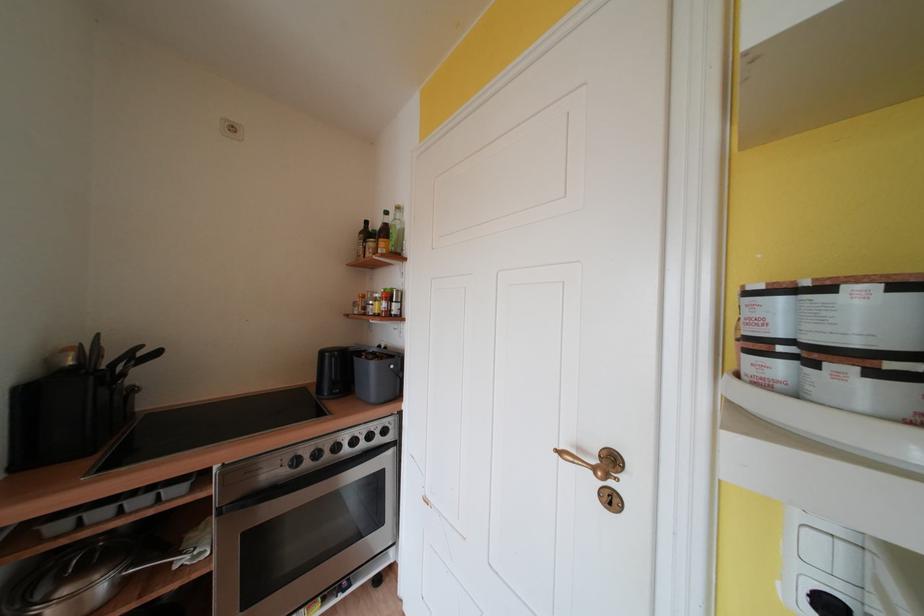
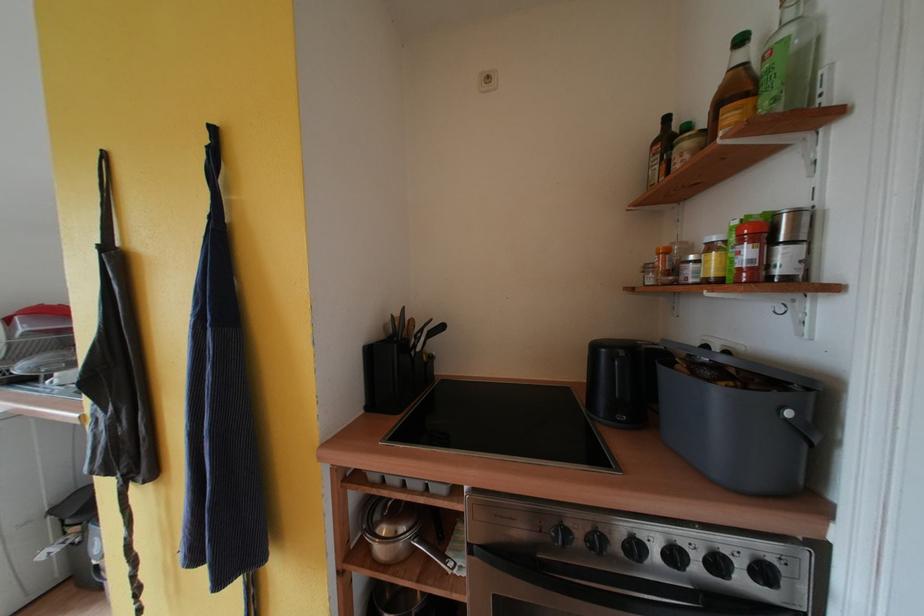
Where in the second image is the point corresponding to point (393, 216) from the first image?

(748, 44)